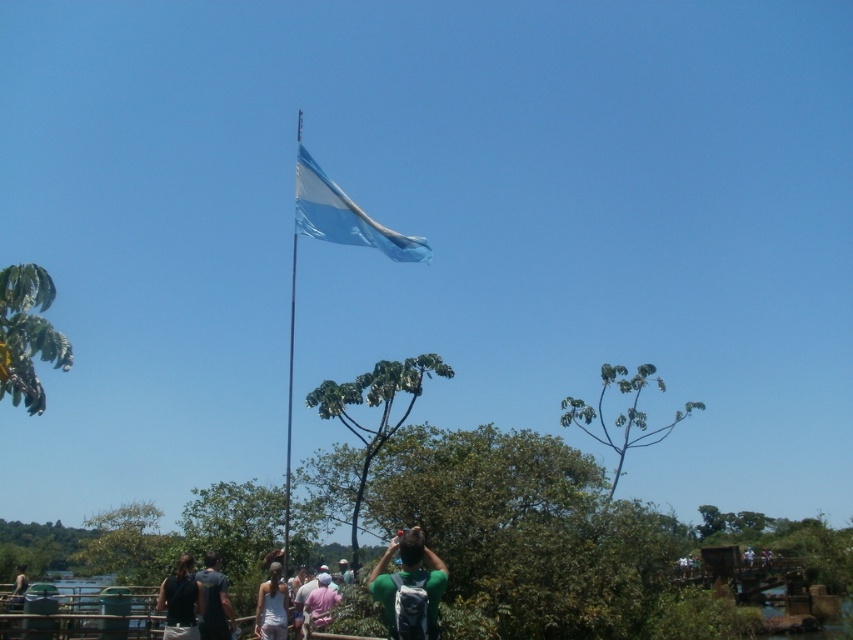
Question: Is dark brown leather jacket at lower left positioned before dark blue shirt at center?

Choices:
 (A) no
 (B) yes

Answer: (A)

Question: Considering the real-world distances, which object is farthest from the green fabric shirt at lower center?

Choices:
 (A) pink fabric shirt at center
 (B) green fabric backpack at center
 (C) dark blue shirt at center

Answer: (B)

Question: Is dark brown leather jacket at lower left wider than white cotton shirt at center?

Choices:
 (A) yes
 (B) no

Answer: (B)

Question: Observing the image, what is the correct spatial positioning of pink fabric shirt at center in reference to green fabric shirt at lower center?

Choices:
 (A) left
 (B) right

Answer: (B)

Question: Among these points, which one is nearest to the camera?

Choices:
 (A) (9, 604)
 (B) (186, 579)
 (C) (341, 202)
 (D) (289, 509)

Answer: (B)

Question: Estimate the real-world distances between objects in this image. Which object is farther from the pink fabric shirt at center?

Choices:
 (A) green fabric backpack at center
 (B) white matte tank top at center

Answer: (A)